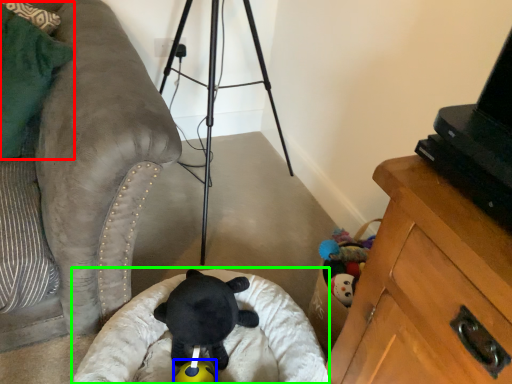
Question: Estimate the real-world distances between objects in this image. Which object is farther from pillow (highlighted by a red box), toy (highlighted by a blue box) or infant bed (highlighted by a green box)?

Choices:
 (A) toy
 (B) infant bed

Answer: (A)